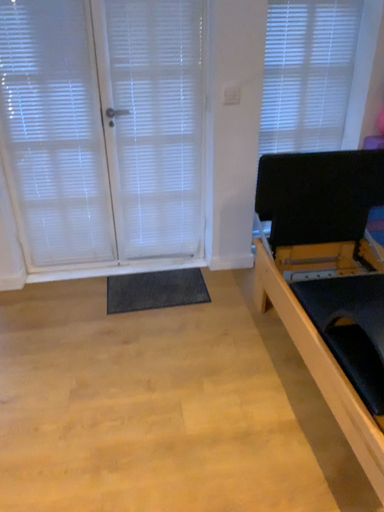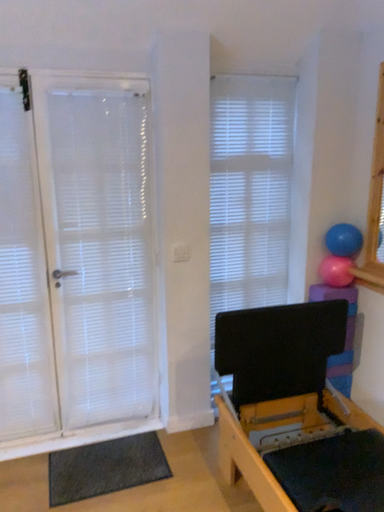
Question: Which way did the camera rotate in the video?

Choices:
 (A) rotated right
 (B) rotated left

Answer: (A)